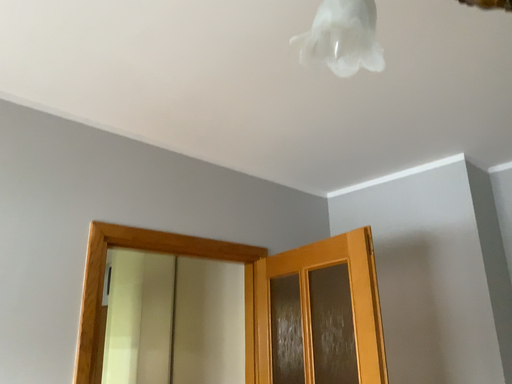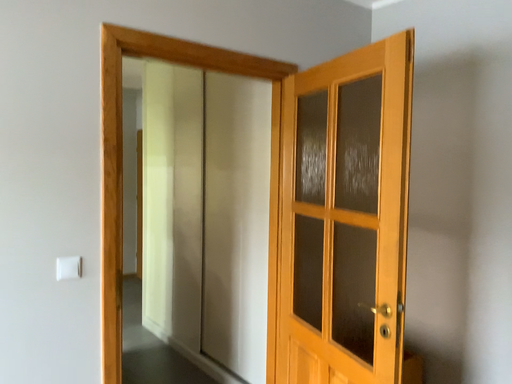
Question: Which way did the camera rotate in the video?

Choices:
 (A) rotated upward
 (B) rotated downward

Answer: (B)